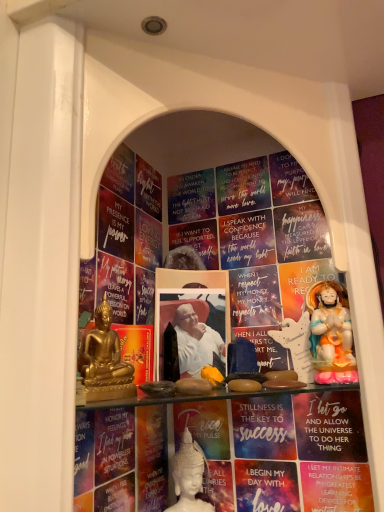
Question: Is matte gold statue at right spatially inside gold metallic statue at left, arranged as the second person when ordered from the bottom, or outside of it?

Choices:
 (A) outside
 (B) inside

Answer: (A)

Question: From the image's perspective, is matte gold statue at right above or below gold metallic statue at left, acting as the third person starting from the back?

Choices:
 (A) below
 (B) above

Answer: (A)

Question: Considering the real-world distances, which object is farthest from the white paper at center, placed as the 2th paperback book when sorted from left to right?

Choices:
 (A) porcelain statue at right, which appears as the 2th person when viewed from the back
 (B) matte blue paperback book at center, the first paperback book in the right-to-left sequence
 (C) matte gold paperback book at center, the 3th paperback book when ordered from right to left
 (D) matte gold statue at right
 (E) gold metallic statue at left, placed as the 2th person when sorted from top to bottom

Answer: (A)

Question: Which object is the farthest from the matte gold paperback book at center, arranged as the first paperback book when viewed from the left?

Choices:
 (A) matte blue paperback book at center, the first paperback book in the right-to-left sequence
 (B) white porcelain statue at center, the 2th person from the left
 (C) white paper at center, placed as the 2th paperback book when sorted from left to right
 (D) porcelain statue at right, the 2th person from the front
 (E) matte gold statue at right

Answer: (D)